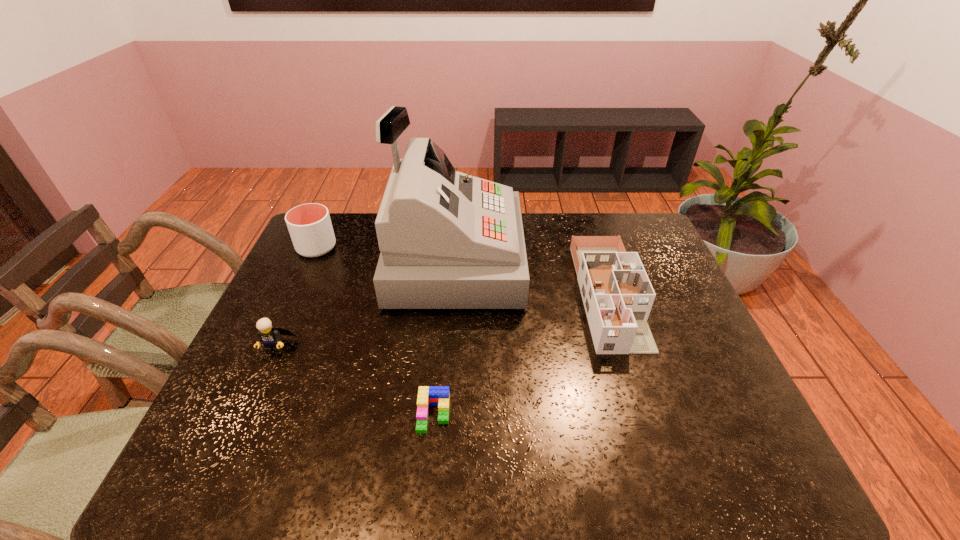
The width and height of the screenshot is (960, 540). I want to click on cash register, so click(x=448, y=240).

Image resolution: width=960 pixels, height=540 pixels. What are the coordinates of `cup` in the screenshot? It's located at (310, 227).

Locate an element on the screen. Image resolution: width=960 pixels, height=540 pixels. the farther Lego is located at coordinates (270, 337).

Locate an element on the screen. the taller Lego is located at coordinates (270, 337).

Locate an element on the screen. dollhouse is located at coordinates (617, 294).

Locate an element on the screen. This screenshot has width=960, height=540. the shortest object is located at coordinates (439, 396).

Identify the location of the shorter Lego. This screenshot has width=960, height=540. (439, 396).

Where is `blank space located on the keypad side of the cash register`? blank space located on the keypad side of the cash register is located at coordinates (575, 261).

This screenshot has height=540, width=960. In order to click on free space located 0.390m on the right of the cup in this screenshot , I will do pos(455,247).

Find the location of a particular element. The width and height of the screenshot is (960, 540). vacant space located 0.310m on the front-facing side of the left Lego is located at coordinates (215, 478).